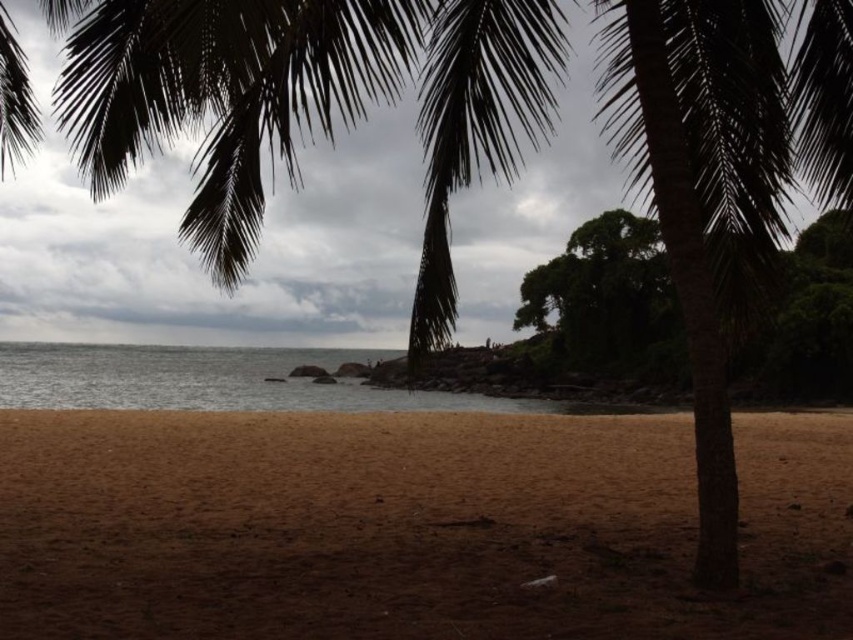
Question: Is green leafy palm tree at center smaller than green leafy tree at center?

Choices:
 (A) no
 (B) yes

Answer: (B)

Question: From the image, what is the correct spatial relationship of brown sandy beach at lower center in relation to green leafy palm tree at center?

Choices:
 (A) right
 (B) left

Answer: (B)

Question: Among these points, which one is farthest from the camera?

Choices:
 (A) (679, 212)
 (B) (521, 310)

Answer: (B)

Question: Is brown sandy beach at lower center smaller than green leafy tree at center?

Choices:
 (A) yes
 (B) no

Answer: (A)

Question: Which object is farther from the camera taking this photo?

Choices:
 (A) green leafy tree at center
 (B) green leafy palm tree at center
 (C) brown sandy beach at lower center

Answer: (A)

Question: Which point appears farthest from the camera in this image?

Choices:
 (A) (619, 371)
 (B) (279, 625)

Answer: (A)